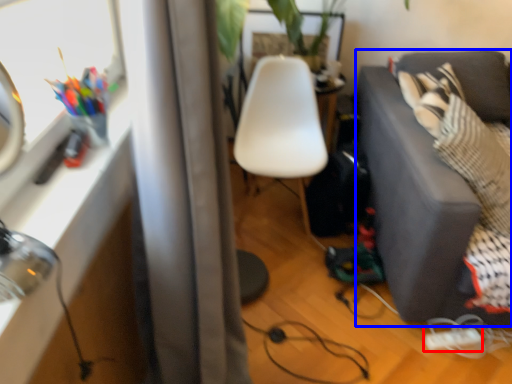
Question: Which of the following is the closest to the observer, extension cord (highlighted by a red box) or studio couch (highlighted by a blue box)?

Choices:
 (A) extension cord
 (B) studio couch

Answer: (B)